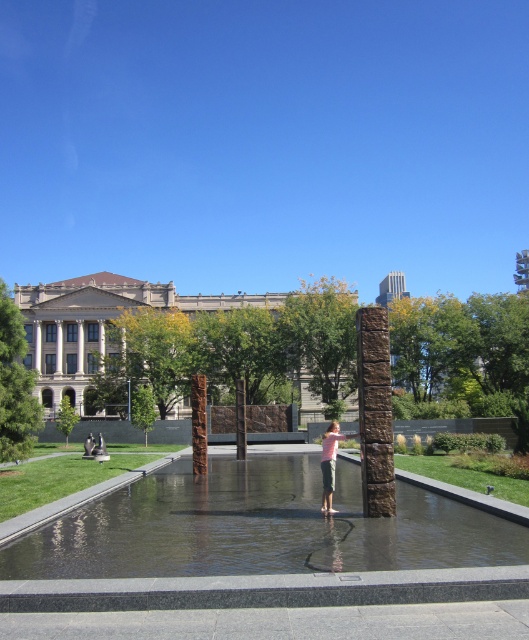
You are a photographer standing in front of the modern water sculpture. You see the clear glass water at center and the pink cotton shirt at center. Which object is closer to you?

The clear glass water at center is closer to you since it is in front of the pink cotton shirt at center.

You are a photographer trying to capture the reflection of the pink cotton shirt at center in the clear glass water at center. Based on the scene description, can you confirm if the reflection will be visible?

The clear glass water at center is above the pink cotton shirt at center, so the reflection of the pink cotton shirt at center would not be visible in the clear glass water at center because the shirt is below the water level.

You are a photographer trying to capture the pink cotton shirt at center and the clear glass water at center in the same frame. Since you want both to be clearly visible, which object should you focus on first to ensure sharpness?

The clear glass water at center is smaller than the pink cotton shirt at center, so focusing on the pink cotton shirt at center first would ensure it remains sharp while the smaller water area might still be in focus depending on the depth of field.